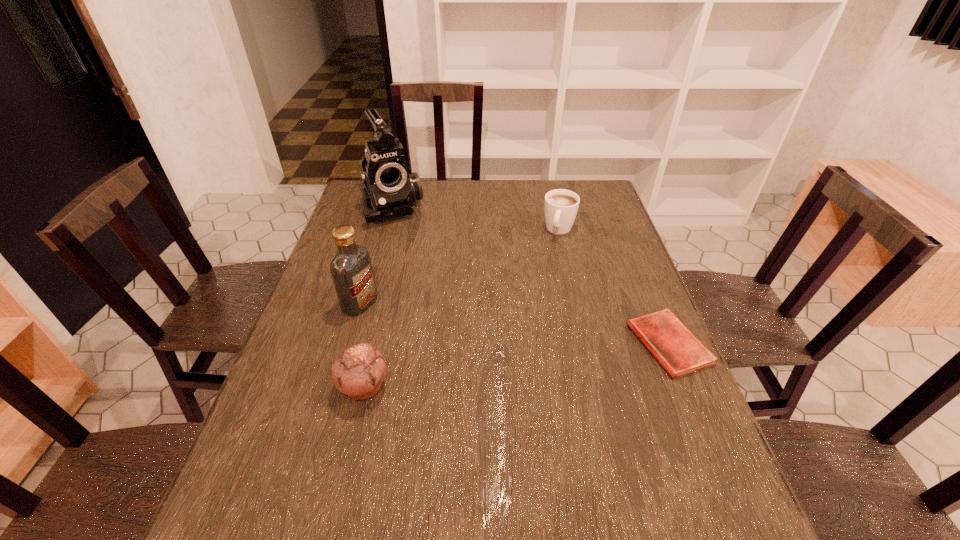
Where is `camcorder that is at the left edge`? This screenshot has width=960, height=540. camcorder that is at the left edge is located at coordinates (390, 190).

Identify the location of diary that is at the right edge. (676, 348).

I want to click on cappuccino situated at the right edge, so click(x=560, y=206).

The width and height of the screenshot is (960, 540). What are the coordinates of `object situated at the far left corner` in the screenshot? It's located at (390, 190).

This screenshot has width=960, height=540. What are the coordinates of `free space at the far edge of the desktop` in the screenshot? It's located at (517, 181).

In the image, there is a desktop. What are the coordinates of `vacant space at the near edge` in the screenshot? It's located at (397, 469).

At what (x,y) coordinates should I click in order to perform the action: click on vacant space at the left edge of the desktop. Please return your answer as a coordinate pair (x, y). Looking at the image, I should click on (281, 389).

The height and width of the screenshot is (540, 960). What are the coordinates of `vacant region at the right edge of the desktop` in the screenshot? It's located at (600, 248).

In the image, there is a desktop. Where is `free space at the near left corner`? free space at the near left corner is located at coordinates (232, 480).

In order to click on vacant point located between the fourth object from left to right and the tallest object in this screenshot , I will do `click(476, 218)`.